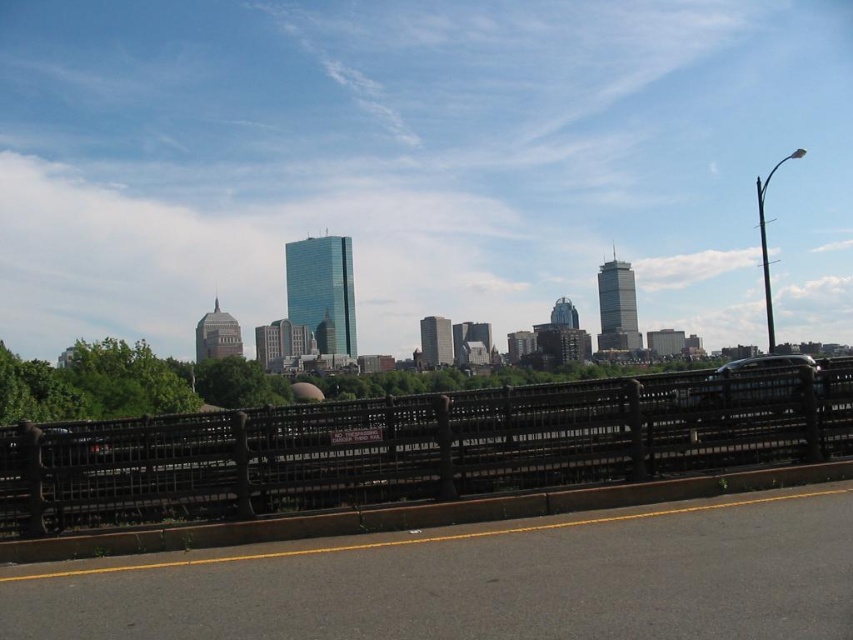
Question: Is black asphalt highway at lower center further to camera compared to black wrought iron fence at center?

Choices:
 (A) no
 (B) yes

Answer: (A)

Question: Is black wrought iron fence at center closer to camera compared to shiny silver car at right?

Choices:
 (A) yes
 (B) no

Answer: (A)

Question: Which point is closer to the camera taking this photo?

Choices:
 (A) (318, 560)
 (B) (747, 384)
 (C) (606, 472)

Answer: (A)

Question: Considering the real-world distances, which object is farthest from the black wrought iron fence at center?

Choices:
 (A) black asphalt highway at lower center
 (B) shiny silver car at right

Answer: (A)

Question: Based on their relative distances, which object is nearer to the black asphalt highway at lower center?

Choices:
 (A) black wrought iron fence at center
 (B) shiny silver car at right

Answer: (A)

Question: Is black asphalt highway at lower center below shiny silver car at right?

Choices:
 (A) no
 (B) yes

Answer: (B)